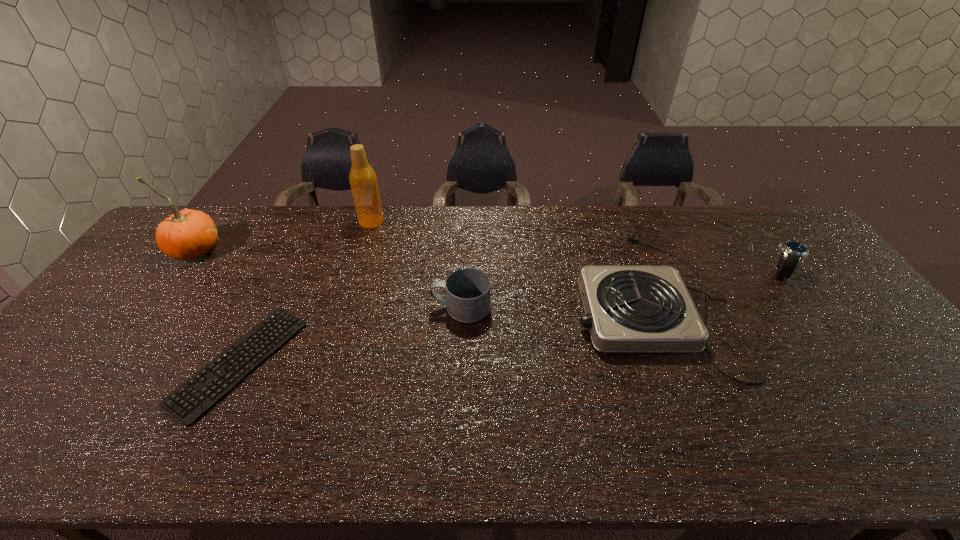
In order to click on the farthest object in this screenshot , I will do `click(363, 180)`.

Locate an element on the screen. This screenshot has width=960, height=540. the third object from left to right is located at coordinates (363, 180).

Locate an element on the screen. The image size is (960, 540). pumpkin is located at coordinates (186, 234).

This screenshot has width=960, height=540. I want to click on the rightmost object, so click(x=793, y=252).

The image size is (960, 540). I want to click on mug, so click(467, 290).

The width and height of the screenshot is (960, 540). I want to click on the fifth tallest object, so click(629, 308).

Locate an element on the screen. hotplate is located at coordinates (629, 308).

I want to click on the fifth object from right to left, so click(194, 398).

What are the coordinates of `the shortest object` in the screenshot? It's located at coord(194,398).

At what (x,y) coordinates should I click in order to perform the action: click on blank area located on the right of the farthest object. Please return your answer as a coordinate pair (x, y). The width and height of the screenshot is (960, 540). Looking at the image, I should click on (401, 221).